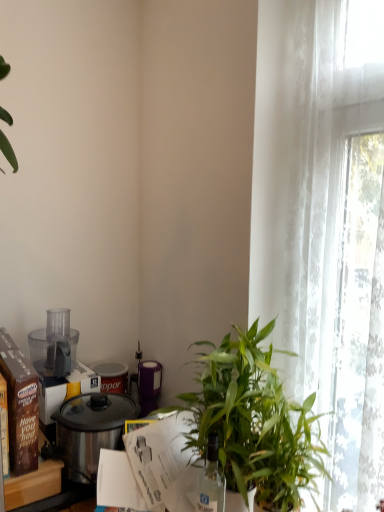
Question: Is transparent plastic food processor at left wider or thinner than transparent glass bottle at center?

Choices:
 (A) thin
 (B) wide

Answer: (B)

Question: Would you say transparent plastic food processor at left is to the left or to the right of transparent glass bottle at center in the picture?

Choices:
 (A) right
 (B) left

Answer: (B)

Question: Estimate the real-world distances between objects in this image. Which object is farther from the green leafy plant at center?

Choices:
 (A) transparent plastic food processor at left
 (B) brown cardboard box at left
 (C) shiny metallic pot at lower left
 (D) brown cardboard box at left, which appears as the first box when viewed from the front
 (E) white sheer curtain at right

Answer: (A)

Question: Which is nearer to the transparent plastic food processor at left?

Choices:
 (A) matte brown box at left, which is counted as the first box, starting from the back
 (B) white sheer curtain at right
 (C) brown cardboard box at left
 (D) shiny metallic pot at lower left
 (E) green leafy plant at center

Answer: (D)